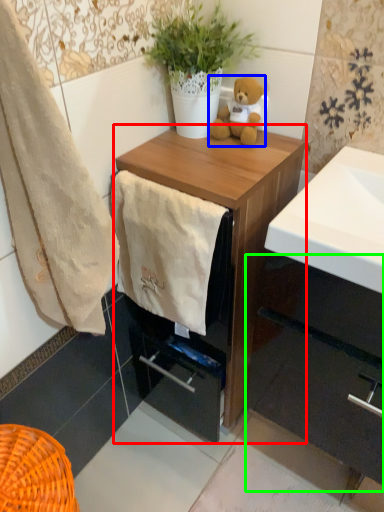
Question: Which is farther away from chest of drawers (highlighted by a red box)? teddy bear (highlighted by a blue box) or cabinetry (highlighted by a green box)?

Choices:
 (A) teddy bear
 (B) cabinetry

Answer: (B)